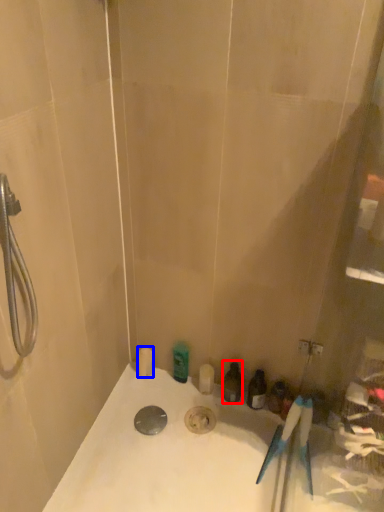
Question: Which object appears closest to the camera in this image, toiletry (highlighted by a red box) or toiletry (highlighted by a blue box)?

Choices:
 (A) toiletry
 (B) toiletry

Answer: (A)